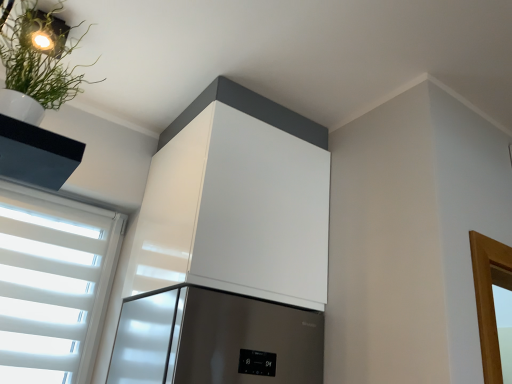
What do you see at coordinates (238, 200) in the screenshot?
I see `white glossy cabinet at upper center` at bounding box center [238, 200].

Where is `white glossy cabinet at upper center`? The image size is (512, 384). white glossy cabinet at upper center is located at coordinates (238, 200).

The width and height of the screenshot is (512, 384). What do you see at coordinates (37, 65) in the screenshot?
I see `green matte plant at upper left` at bounding box center [37, 65].

You are a GUI agent. You are given a task and a screenshot of the screen. Output one action in this format:
    pyautogui.click(x=<x>, y=<y>)
    Task: Click on the green matte plant at upper left
    This screenshot has width=512, height=384.
    Given the screenshot: What is the action you would take?
    pyautogui.click(x=37, y=65)

Image resolution: width=512 pixels, height=384 pixels. What are the coordinates of `white glossy cabinet at upper center` in the screenshot? It's located at [238, 200].

Which is more to the right, white glossy cabinet at upper center or green matte plant at upper left?

→ white glossy cabinet at upper center is more to the right.

Which object is further away from the camera, white glossy cabinet at upper center or green matte plant at upper left?

white glossy cabinet at upper center.

Is point (166, 197) closer to camera compared to point (75, 94)?

No, (166, 197) is further to viewer.

From the image's perspective, would you say white glossy cabinet at upper center is positioned over green matte plant at upper left?

Incorrect, from the image's perspective, white glossy cabinet at upper center is lower than green matte plant at upper left.

From a real-world perspective, is white glossy cabinet at upper center positioned under green matte plant at upper left based on gravity?

No, from a real-world perspective, white glossy cabinet at upper center is not under green matte plant at upper left.

From the picture: Can you confirm if white glossy cabinet at upper center is wider than green matte plant at upper left?

Yes, white glossy cabinet at upper center is wider than green matte plant at upper left.

Is white glossy cabinet at upper center taller than green matte plant at upper left?

Yes, white glossy cabinet at upper center is taller than green matte plant at upper left.

Based on their sizes in the image, would you say white glossy cabinet at upper center is bigger or smaller than green matte plant at upper left?

white glossy cabinet at upper center is bigger than green matte plant at upper left.

Would you say white glossy cabinet at upper center contains green matte plant at upper left?

That's incorrect, green matte plant at upper left is not inside white glossy cabinet at upper center.

Does white glossy cabinet at upper center touch green matte plant at upper left?

No, white glossy cabinet at upper center is not in contact with green matte plant at upper left.

Could you tell me if white glossy cabinet at upper center is turned towards green matte plant at upper left?

No, white glossy cabinet at upper center does not turn towards green matte plant at upper left.

How many degrees apart are the facing directions of white glossy cabinet at upper center and green matte plant at upper left?

white glossy cabinet at upper center and green matte plant at upper left are facing 7.57 degrees away from each other.

You are a GUI agent. You are given a task and a screenshot of the screen. Output one action in this format:
    pyautogui.click(x=<x>, y=<y>)
    Task: Click on the appliance that appears behind the green matte plant at upper left
    The image size is (512, 384).
    Given the screenshot: What is the action you would take?
    pyautogui.click(x=238, y=200)

Can you confirm if green matte plant at upper left is positioned to the right of white glossy cabinet at upper center?

In fact, green matte plant at upper left is to the left of white glossy cabinet at upper center.

Does green matte plant at upper left lie behind white glossy cabinet at upper center?

No, the depth of green matte plant at upper left is less than that of white glossy cabinet at upper center.

Is point (65, 70) positioned after point (298, 215)?

No, (65, 70) is closer to viewer.

From the image's perspective, is green matte plant at upper left on white glossy cabinet at upper center?

Correct, green matte plant at upper left appears higher than white glossy cabinet at upper center in the image.

From a real-world perspective, is green matte plant at upper left over white glossy cabinet at upper center?

→ Incorrect, from a real-world perspective, green matte plant at upper left is lower than white glossy cabinet at upper center.

Is green matte plant at upper left wider than white glossy cabinet at upper center?

Incorrect, the width of green matte plant at upper left does not surpass that of white glossy cabinet at upper center.

Which of these two, green matte plant at upper left or white glossy cabinet at upper center, stands taller?

With more height is white glossy cabinet at upper center.

Based on their sizes in the image, would you say green matte plant at upper left is bigger or smaller than white glossy cabinet at upper center?

Considering their sizes, green matte plant at upper left takes up less space than white glossy cabinet at upper center.

Is white glossy cabinet at upper center surrounded by green matte plant at upper left?

Definitely not — white glossy cabinet at upper center is not inside green matte plant at upper left.

Would you consider green matte plant at upper left to be distant from white glossy cabinet at upper center?

Actually, green matte plant at upper left and white glossy cabinet at upper center are a little close together.

Is white glossy cabinet at upper center at the back of green matte plant at upper left?

green matte plant at upper left is not turned away from white glossy cabinet at upper center.

Can you tell me how much green matte plant at upper left and white glossy cabinet at upper center differ in facing direction?

7.57 degrees.

Locate an element on the screen. This screenshot has height=384, width=512. houseplant directly beneath the white glossy cabinet at upper center (from a real-world perspective) is located at coordinates (37, 65).

Find the location of a particular element. houseplant lying on the left of white glossy cabinet at upper center is located at coordinates (37, 65).

The height and width of the screenshot is (384, 512). I want to click on appliance on the right of green matte plant at upper left, so click(x=238, y=200).